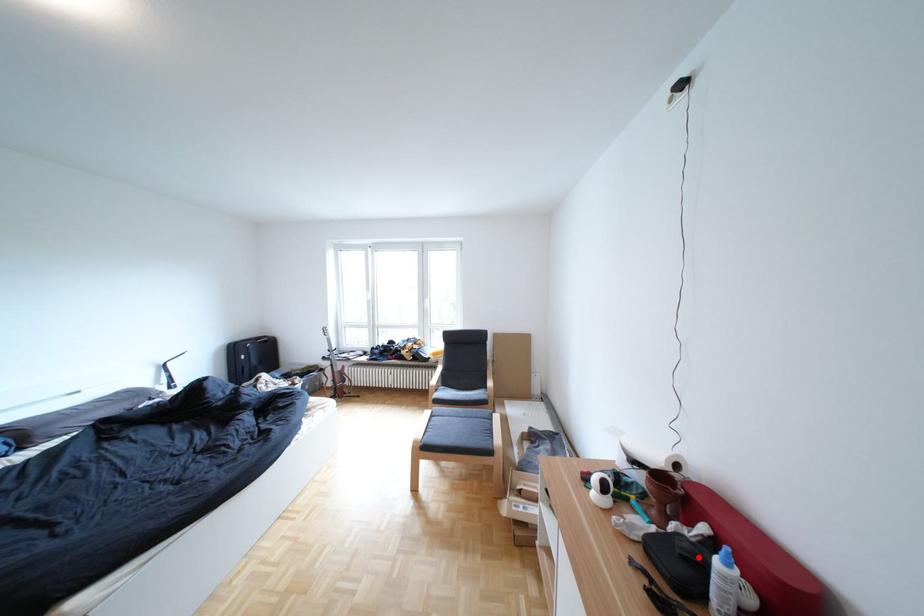
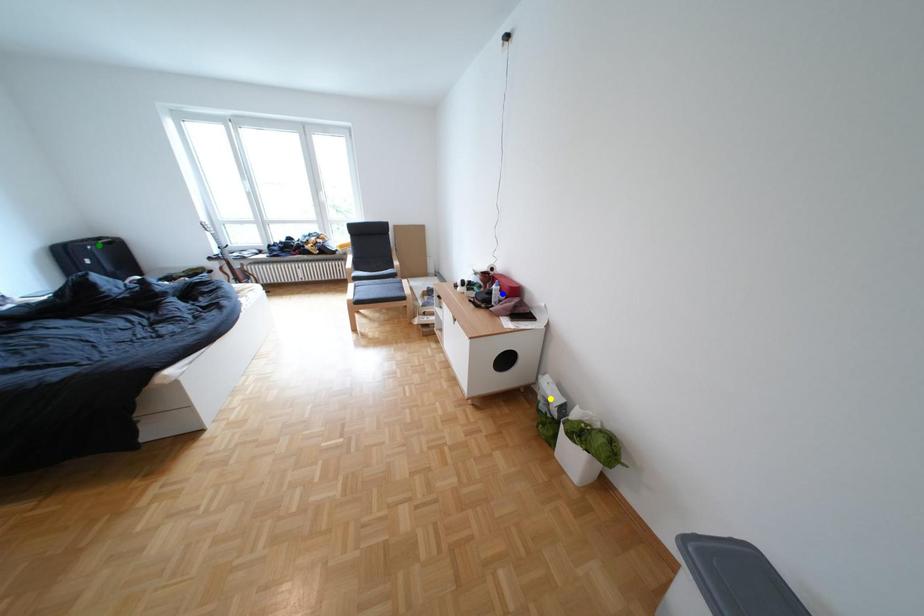
Question: I am providing you with two images of the same scene from different viewpoints. A red point is marked on the first image. You are given multiple points on the second image. Which point in image 2 represents the same 3d spot as the red point in image 1?

Choices:
 (A) blue point
 (B) green point
 (C) yellow point

Answer: (A)